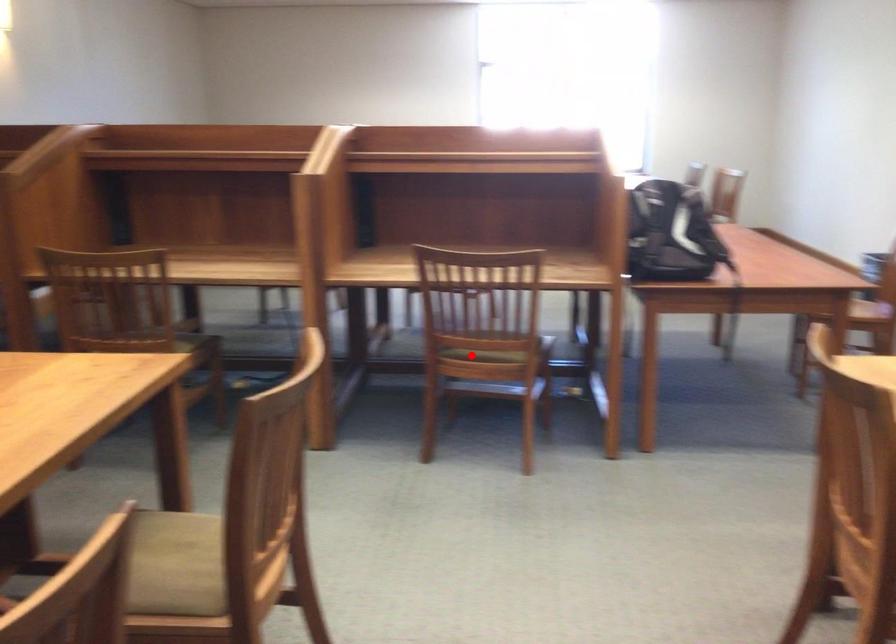
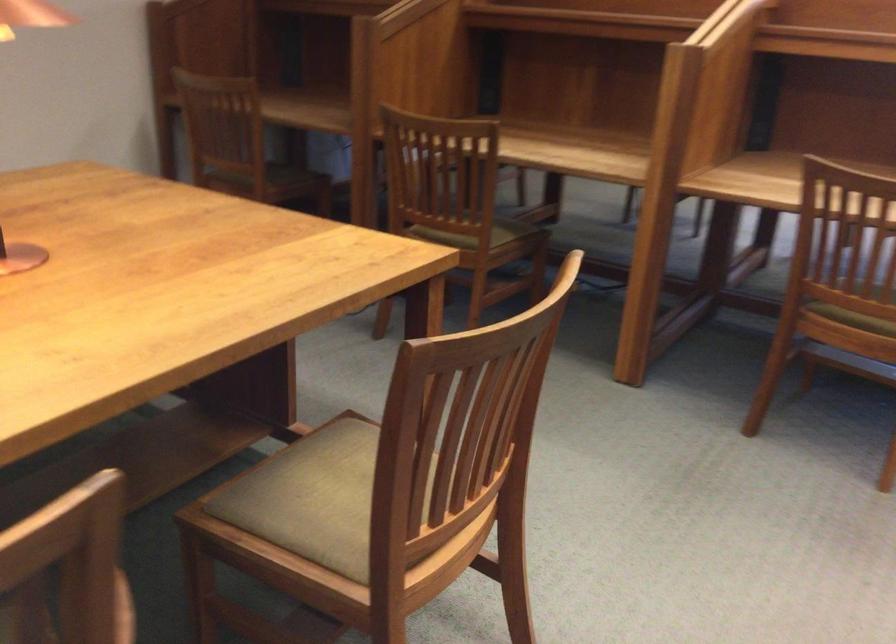
Locate, in the second image, the point that corresponds to the highlighted location in the first image.

(855, 313)